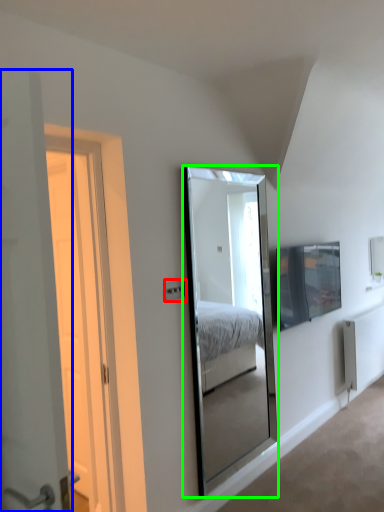
Question: Which object is positioned farthest from electric outlet (highlighted by a red box)? Select from door (highlighted by a blue box) and mirror (highlighted by a green box).

Choices:
 (A) door
 (B) mirror

Answer: (B)